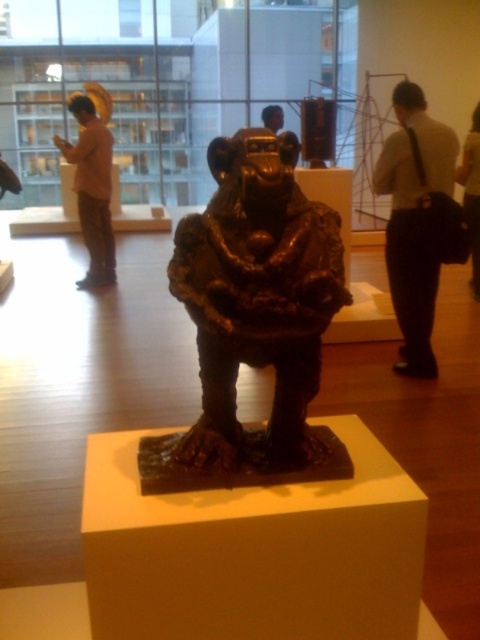
Is smooth black shirt at upper right wider than matte black statue at center?

Indeed, smooth black shirt at upper right has a greater width compared to matte black statue at center.

You are a GUI agent. You are given a task and a screenshot of the screen. Output one action in this format:
    pyautogui.click(x=<x>, y=<y>)
    Task: Click on the smooth black shirt at upper right
    This screenshot has height=640, width=480.
    Given the screenshot: What is the action you would take?
    point(471,195)

Can you confirm if white shirt and black pants at right is positioned to the left of smooth black shirt at upper right?

Indeed, white shirt and black pants at right is positioned on the left side of smooth black shirt at upper right.

Describe the element at coordinates (414, 220) in the screenshot. I see `white shirt and black pants at right` at that location.

Where is `white shirt and black pants at right`? The image size is (480, 640). white shirt and black pants at right is located at coordinates [414, 220].

Does point (235, 356) lie in front of point (407, 196)?

That is True.

Which is above, bronze/statue at center or white shirt and black pants at right?

white shirt and black pants at right is higher up.

The image size is (480, 640). What do you see at coordinates (252, 316) in the screenshot?
I see `bronze/statue at center` at bounding box center [252, 316].

Locate an element on the screen. The height and width of the screenshot is (640, 480). bronze/statue at center is located at coordinates (252, 316).